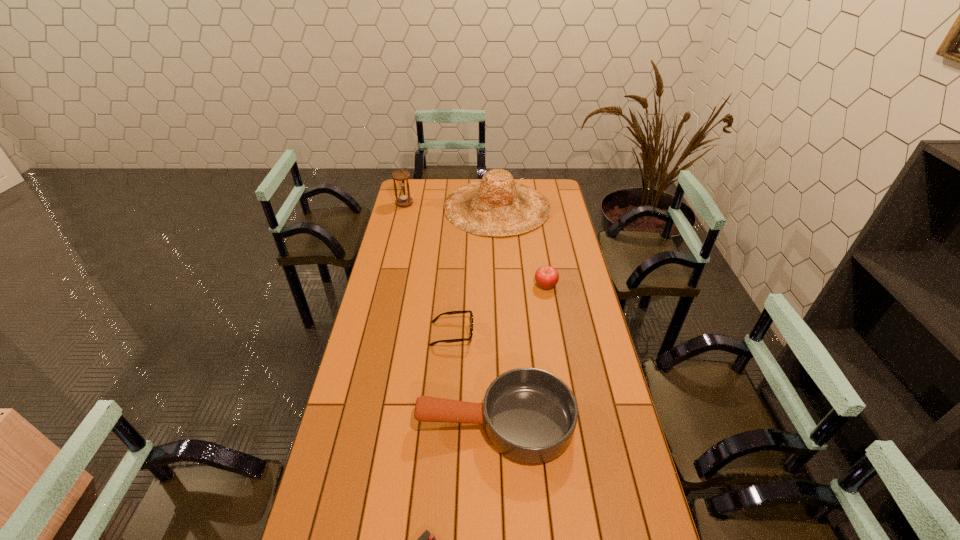
This screenshot has height=540, width=960. In order to click on object located in the far right corner section of the desktop in this screenshot , I will do `click(497, 205)`.

I want to click on vacant position at the right edge of the desktop, so click(x=564, y=381).

Where is `vacant space at the far right corner of the desktop`? The width and height of the screenshot is (960, 540). vacant space at the far right corner of the desktop is located at coordinates (556, 200).

Find the location of `free area in between the third nearest object and the fifth farthest object`. free area in between the third nearest object and the fifth farthest object is located at coordinates (473, 378).

You are a GUI agent. You are given a task and a screenshot of the screen. Output one action in this format:
    pyautogui.click(x=<x>, y=<y>)
    Task: Click on the empty space between the apple and the hourglass
    The image size is (960, 540).
    Given the screenshot: What is the action you would take?
    pyautogui.click(x=475, y=244)

I want to click on empty space that is in between the fourth farthest object and the second nearest object, so click(x=473, y=378).

At what (x,y) coordinates should I click in order to perform the action: click on free space between the apple and the third nearest object. Please return your answer as a coordinate pair (x, y). Looking at the image, I should click on (499, 309).

Identify the location of empty location between the apple and the spectacles. The height and width of the screenshot is (540, 960). (499, 309).

Image resolution: width=960 pixels, height=540 pixels. Find the location of `free area in between the second shortest object and the pan`. free area in between the second shortest object and the pan is located at coordinates (473, 378).

Locate which object ranks third in proximity to the apple. Please provide its 2D coordinates. Your answer should be formatted as a tuple, i.e. [(x, y)], where the tuple contains the x and y coordinates of a point satisfying the conditions above.

[(529, 415)]